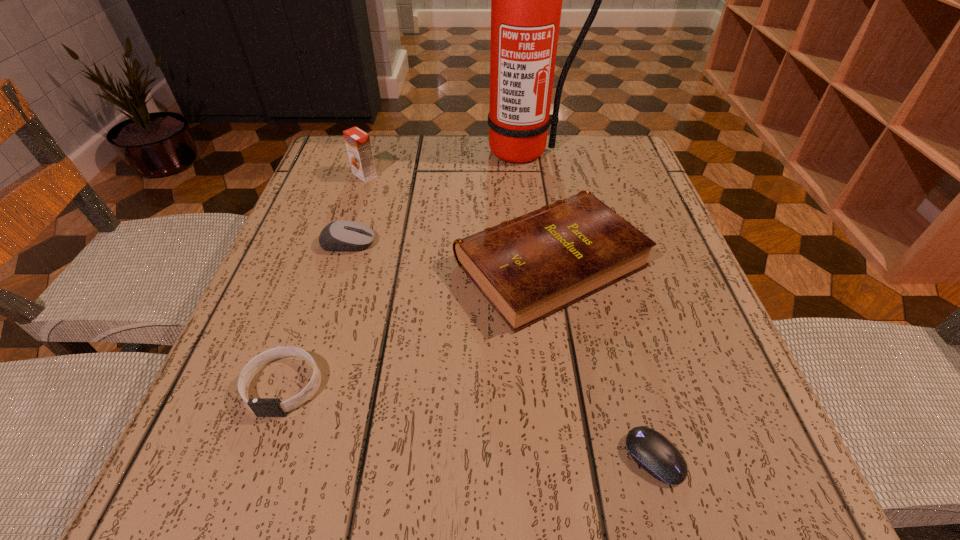
The image size is (960, 540). What are the coordinates of `the tallest object` in the screenshot? It's located at (526, 0).

The height and width of the screenshot is (540, 960). In order to click on fire extinguisher in this screenshot , I will do `click(526, 0)`.

Where is `orange juice`? The height and width of the screenshot is (540, 960). orange juice is located at coordinates click(x=358, y=145).

Locate an element on the screen. The width and height of the screenshot is (960, 540). the second tallest object is located at coordinates (358, 145).

Locate an element on the screen. the third tallest object is located at coordinates (532, 266).

Identify the location of the farther computer mouse. The width and height of the screenshot is (960, 540). (343, 235).

This screenshot has width=960, height=540. I want to click on the left computer mouse, so (343, 235).

At what (x,y) coordinates should I click in order to perform the action: click on the second nearest object. Please return your answer as a coordinate pair (x, y). This screenshot has height=540, width=960. Looking at the image, I should click on pyautogui.click(x=262, y=407).

Locate an element on the screen. the shortest object is located at coordinates (648, 448).

Identify the location of the right computer mouse. The width and height of the screenshot is (960, 540). (648, 448).